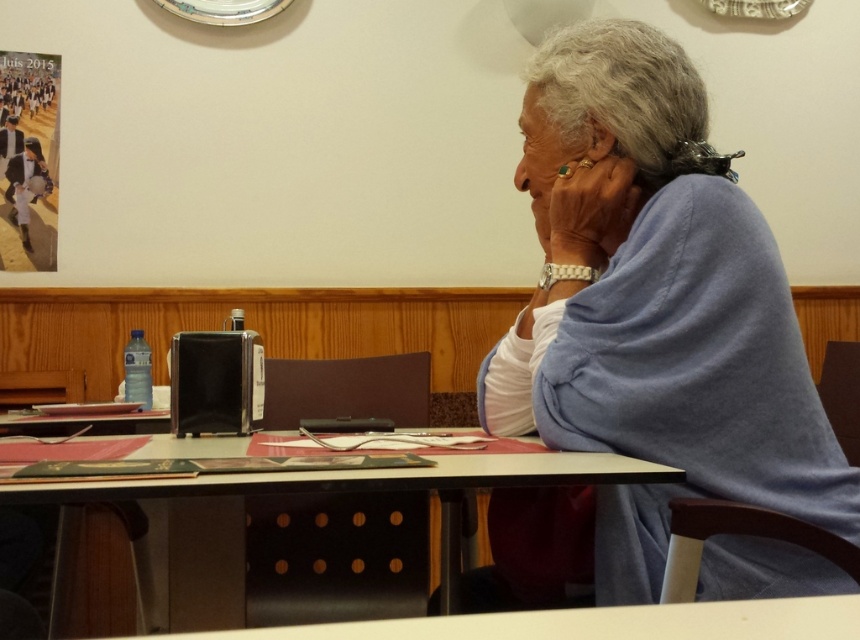
Does blue fabric at upper right have a smaller size compared to black plastic table at center?

Yes.

Find the location of `blue fabric at upper right`. blue fabric at upper right is located at coordinates (654, 307).